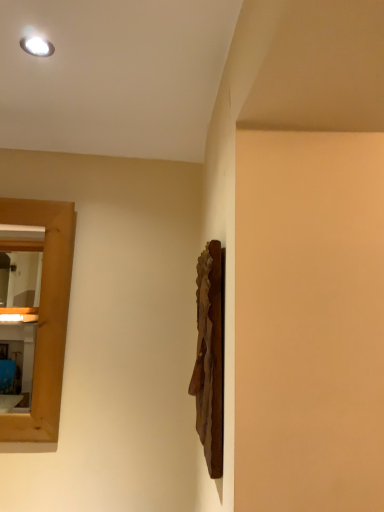
What are the coordinates of `wooden sculpture at center-right` in the screenshot? It's located at (210, 356).

What is the approximate width of wooden sculpture at center-right?

wooden sculpture at center-right is 2.30 inches in width.

What do you see at coordinates (210, 356) in the screenshot? I see `wooden sculpture at center-right` at bounding box center [210, 356].

Find the location of a particular element. The height and width of the screenshot is (512, 384). wooden sculpture at center-right is located at coordinates (210, 356).